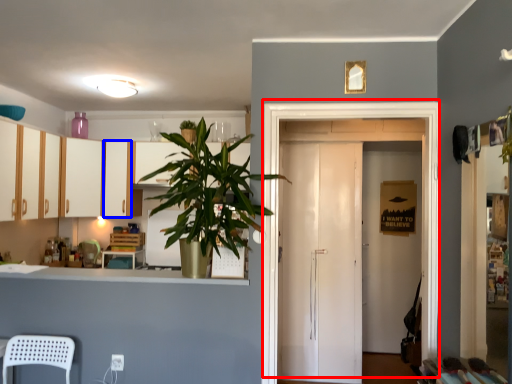
Question: Which of the following is the farthest to the observer, door (highlighted by a red box) or cabinetry (highlighted by a blue box)?

Choices:
 (A) door
 (B) cabinetry

Answer: (B)